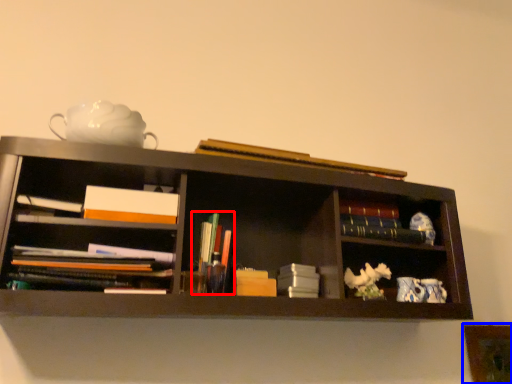
Question: Which object is further to the camera taking this photo, book (highlighted by a red box) or picture frame (highlighted by a blue box)?

Choices:
 (A) book
 (B) picture frame

Answer: (B)